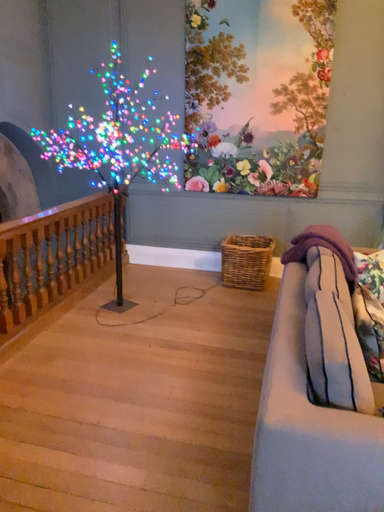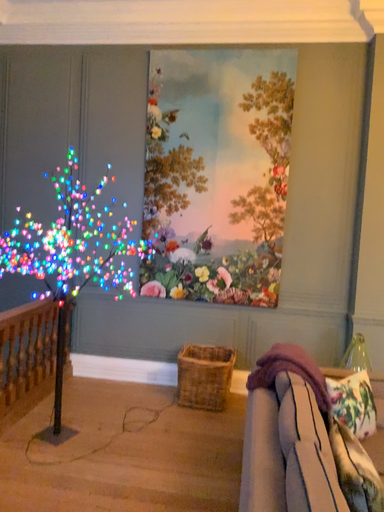
Question: How did the camera likely rotate when shooting the video?

Choices:
 (A) rotated left
 (B) rotated right

Answer: (B)